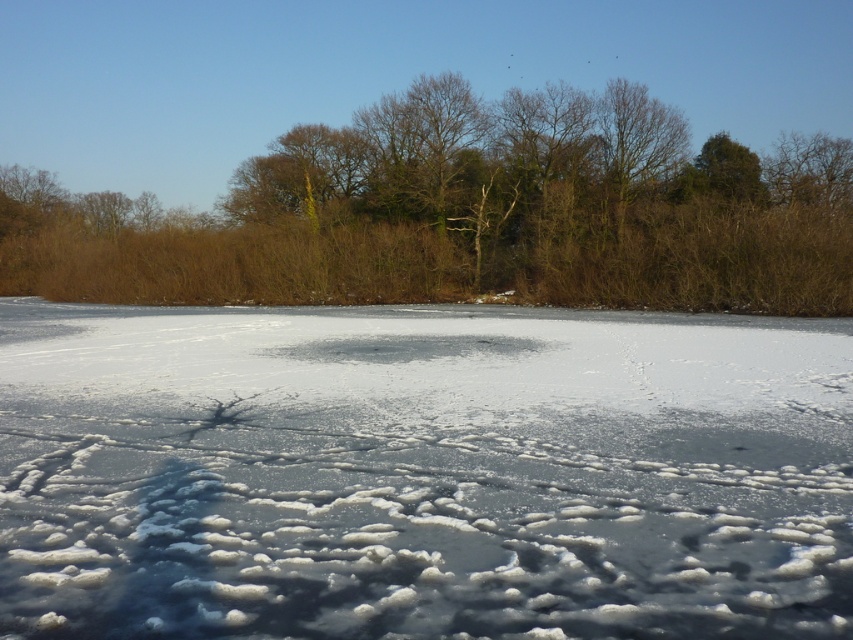
Question: In this image, where is transparent ice at center located relative to brown/drytree at upper center?

Choices:
 (A) right
 (B) left

Answer: (A)

Question: Which object is farther from the camera taking this photo?

Choices:
 (A) transparent ice at center
 (B) brown/drytree at upper center

Answer: (B)

Question: Does transparent ice at center have a smaller size compared to brown/drytree at upper center?

Choices:
 (A) no
 (B) yes

Answer: (B)

Question: Observing the image, what is the correct spatial positioning of transparent ice at center in reference to brown/drytree at upper center?

Choices:
 (A) above
 (B) below

Answer: (B)